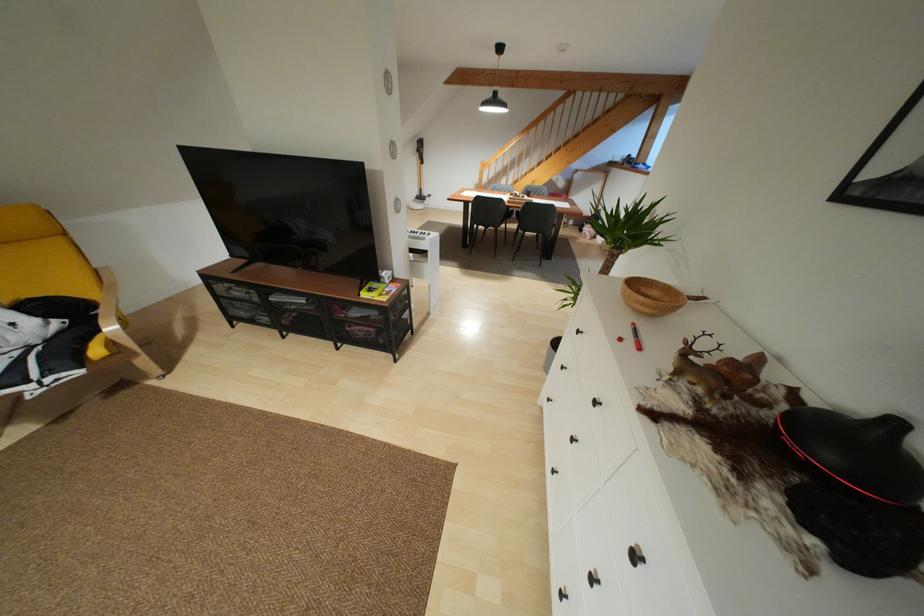
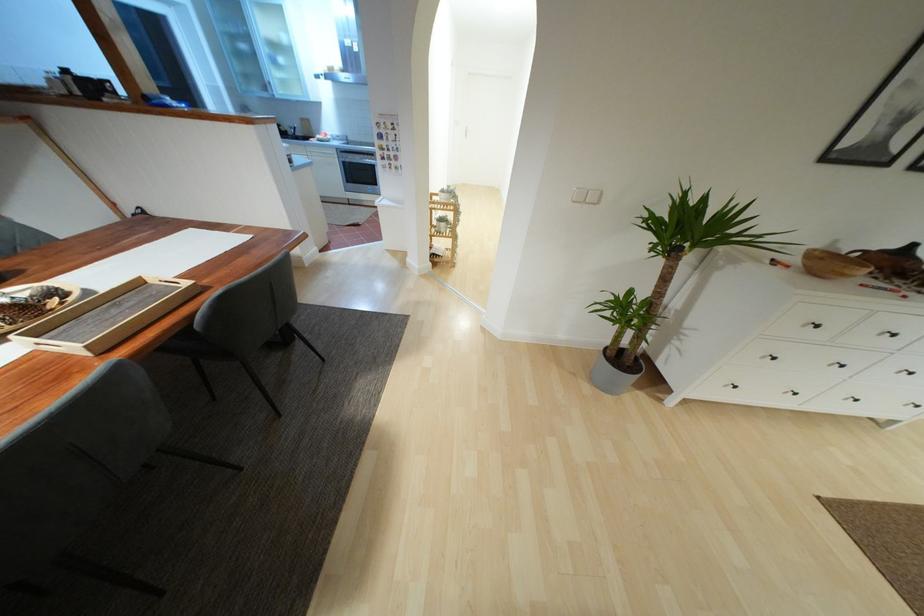
Locate, in the second image, the point that corresponds to the point at 578,331 in the first image.

(817, 326)